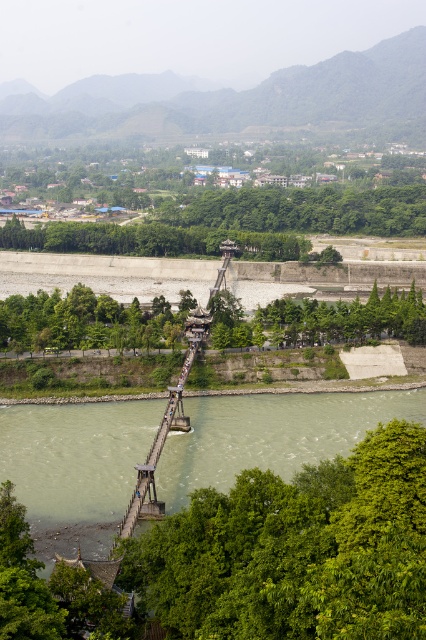
Question: Which point is closer to the camera?

Choices:
 (A) greenish-brown water at center
 (B) green leafy tree at lower left

Answer: (A)

Question: Which point is farther to the camera?

Choices:
 (A) (54, 456)
 (B) (123, 310)
 (C) (376, 288)

Answer: (C)

Question: Does greenish-brown water at center appear on the right side of green leafy trees at center?

Choices:
 (A) yes
 (B) no

Answer: (B)

Question: Is the position of greenish-brown water at center more distant than that of green leafy trees at center?

Choices:
 (A) yes
 (B) no

Answer: (B)

Question: Which point is closer to the camera?

Choices:
 (A) greenish-brown water at center
 (B) green leafy trees at center
 (C) green leafy tree at lower left

Answer: (A)

Question: Observing the image, what is the correct spatial positioning of greenish-brown water at center in reference to green leafy tree at lower left?

Choices:
 (A) right
 (B) left

Answer: (A)